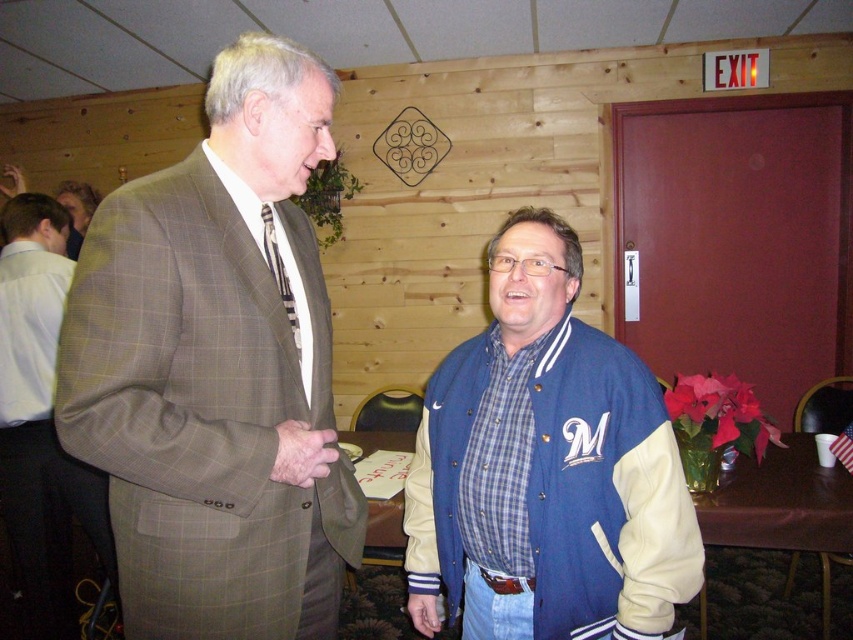
Question: Which object is positioned farthest from the plaid wool suit at center?

Choices:
 (A) matte gray suit at left
 (B) blue/white varsity jacket at center
 (C) light brown suit at left

Answer: (C)

Question: Is blue/white varsity jacket at center below light brown suit at left?

Choices:
 (A) yes
 (B) no

Answer: (A)

Question: Can you confirm if matte gray suit at left is smaller than light brown suit at left?

Choices:
 (A) yes
 (B) no

Answer: (A)

Question: Estimate the real-world distances between objects in this image. Which object is farther from the plaid wool suit at center?

Choices:
 (A) light brown suit at left
 (B) blue/white varsity jacket at center

Answer: (A)

Question: Is matte gray suit at left thinner than light brown suit at left?

Choices:
 (A) no
 (B) yes

Answer: (B)

Question: Which point is closer to the camera?

Choices:
 (A) light brown suit at left
 (B) matte gray suit at left

Answer: (B)